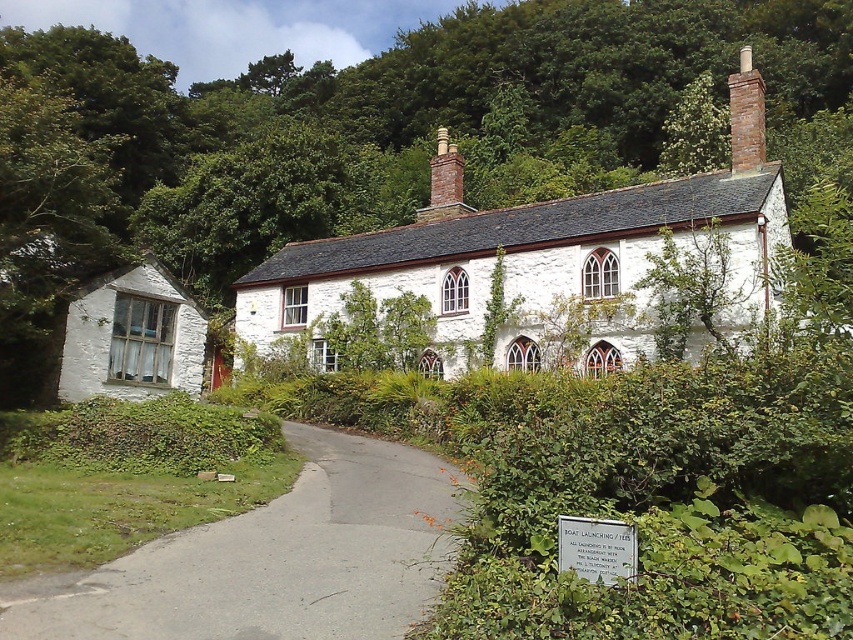
You are standing at the entrance of the property and want to walk towards the white stone cottage at center. Which direction should you walk relative to the white matte cottage at left?

You should walk to the right of the white matte cottage at left to reach the white stone cottage at center since it is positioned to the right of it.

You are a drone operator trying to capture aerial footage of the white stone cottage at center and the gray asphalt driveway at lower center. Considering their heights, which object should you focus on first to ensure they both fit in the frame?

The white stone cottage at center is taller than the gray asphalt driveway at lower center, so you should focus on the white stone cottage at center first to ensure both fit in the frame.